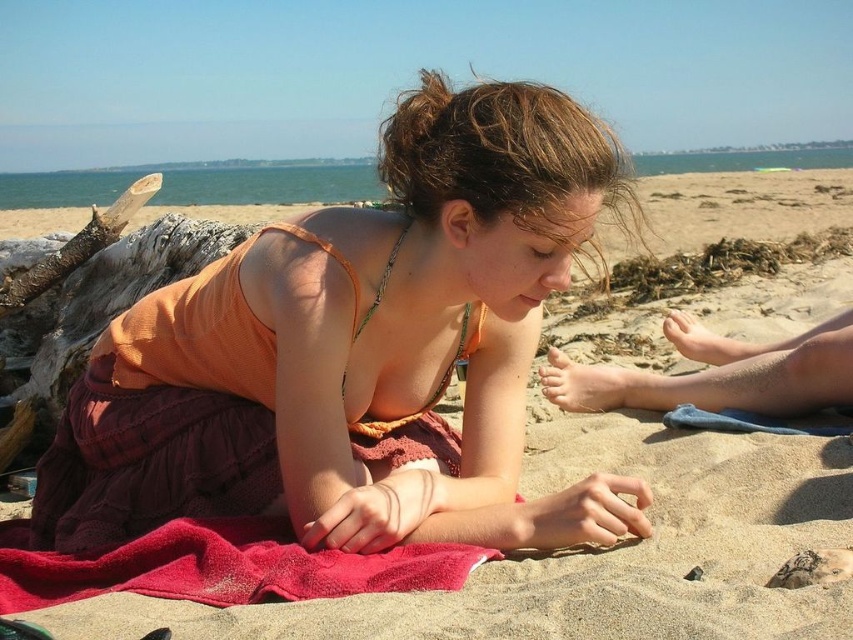
Does orange fabric dress at center have a larger size compared to red terry cloth at lower center?

Indeed, orange fabric dress at center has a larger size compared to red terry cloth at lower center.

Can you confirm if orange fabric dress at center is wider than red terry cloth at lower center?

Indeed, orange fabric dress at center has a greater width compared to red terry cloth at lower center.

Measure the distance between point (216, 451) and camera.

Point (216, 451) and camera are 1.93 meters apart from each other.

I want to click on orange fabric dress at center, so click(357, 352).